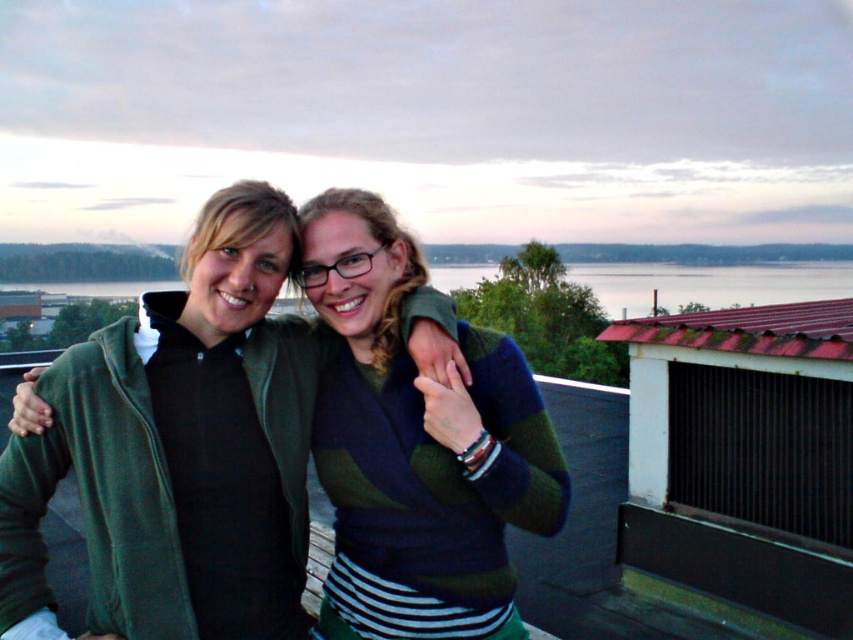
Does green fleece jacket at center have a lesser height compared to striped sweater at center?

Yes.

Can you confirm if green fleece jacket at center is smaller than striped sweater at center?

No, green fleece jacket at center is not smaller than striped sweater at center.

Is point (187, 330) positioned in front of point (480, 467)?

No, (187, 330) is behind (480, 467).

Identify the location of green fleece jacket at center. (183, 448).